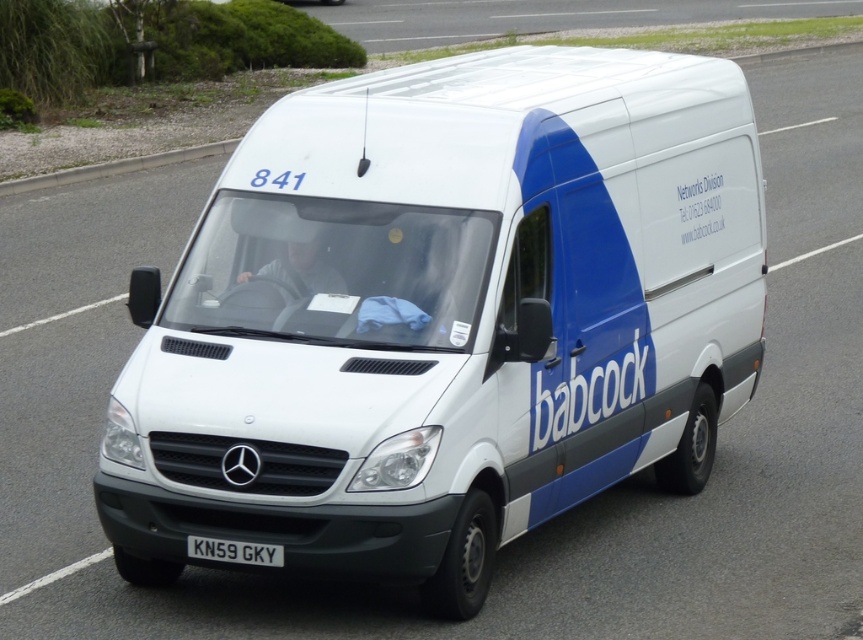
Question: Is white matte van at center further to camera compared to white metallic license plate at center?

Choices:
 (A) yes
 (B) no

Answer: (B)

Question: Which point is closer to the camera taking this photo?

Choices:
 (A) (433, 593)
 (B) (281, 561)

Answer: (B)

Question: Does white matte van at center have a smaller size compared to white metallic license plate at center?

Choices:
 (A) yes
 (B) no

Answer: (B)

Question: Among these points, which one is nearest to the camera?

Choices:
 (A) (632, 246)
 (B) (268, 557)

Answer: (B)

Question: Does white matte van at center appear on the right side of white metallic license plate at center?

Choices:
 (A) yes
 (B) no

Answer: (A)